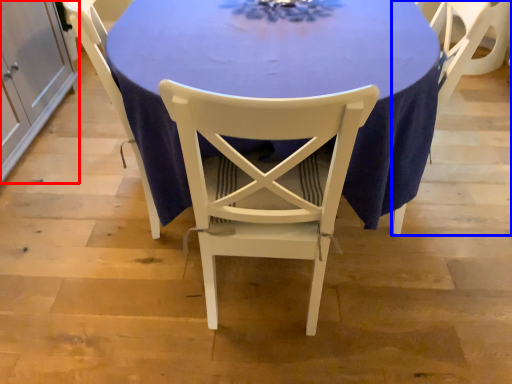
Question: Which point is closer to the camera, cabinetry (highlighted by a red box) or chair (highlighted by a blue box)?

Choices:
 (A) cabinetry
 (B) chair

Answer: (B)